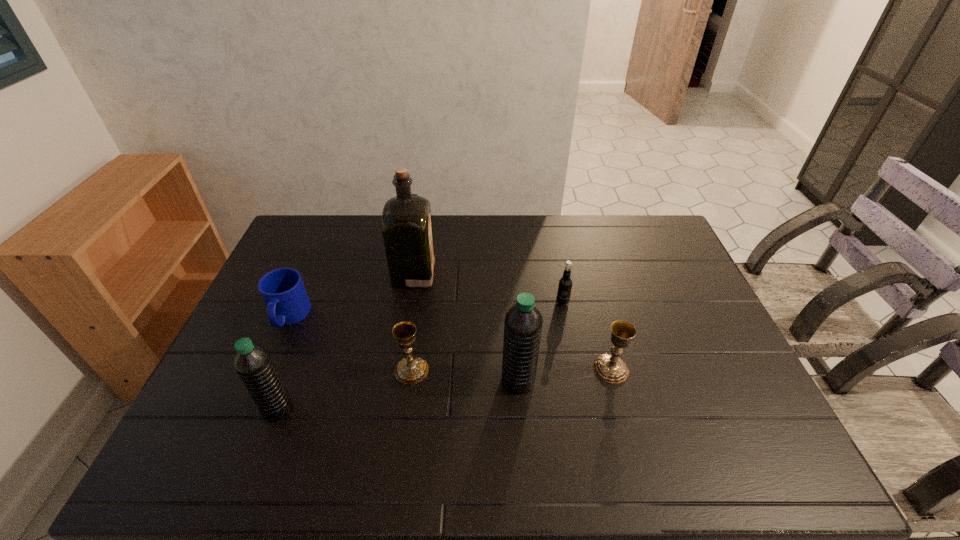
All water bottles are currently evenly spaced. To continue this pattern, where would you add another water bottle on the right? Please point out a vacant spot. Please provide its 2D coordinates. Your answer should be formatted as a tuple, i.e. [(x, y)], where the tuple contains the x and y coordinates of a point satisfying the conditions above.

[(734, 355)]